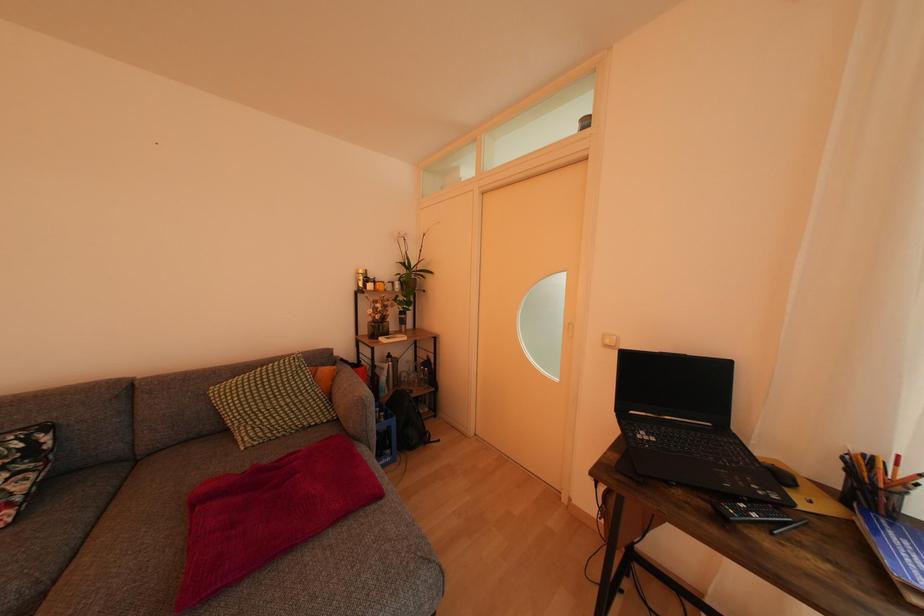
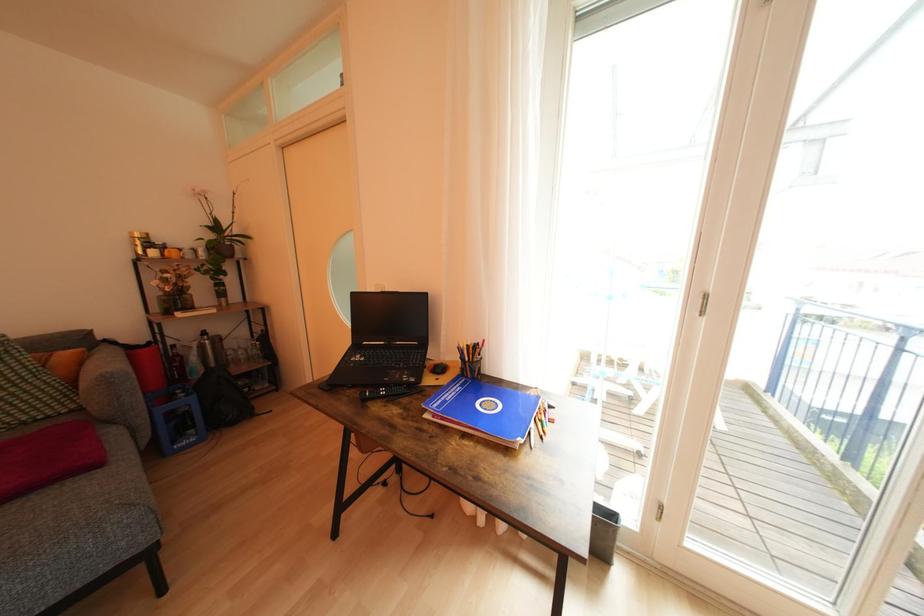
Question: The images are taken continuously from a first-person perspective. In which direction is your viewpoint rotating?

Choices:
 (A) Left
 (B) Right
 (C) Up
 (D) Down

Answer: (B)